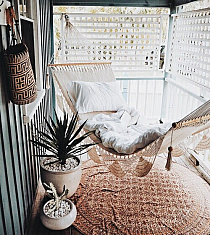
Locate an element on the screen. This screenshot has height=235, width=210. pot is located at coordinates click(x=70, y=182), click(x=64, y=220).